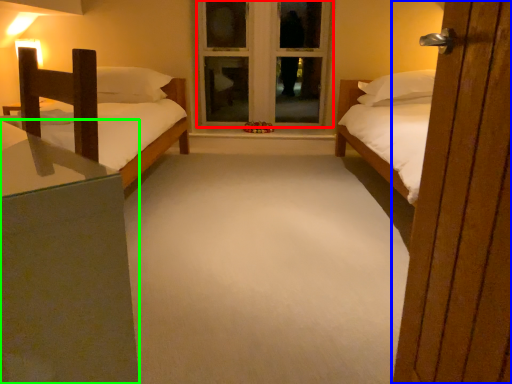
Question: Which is farther away from window frame (highlighted by a red box)? door (highlighted by a blue box) or nightstand (highlighted by a green box)?

Choices:
 (A) door
 (B) nightstand

Answer: (B)